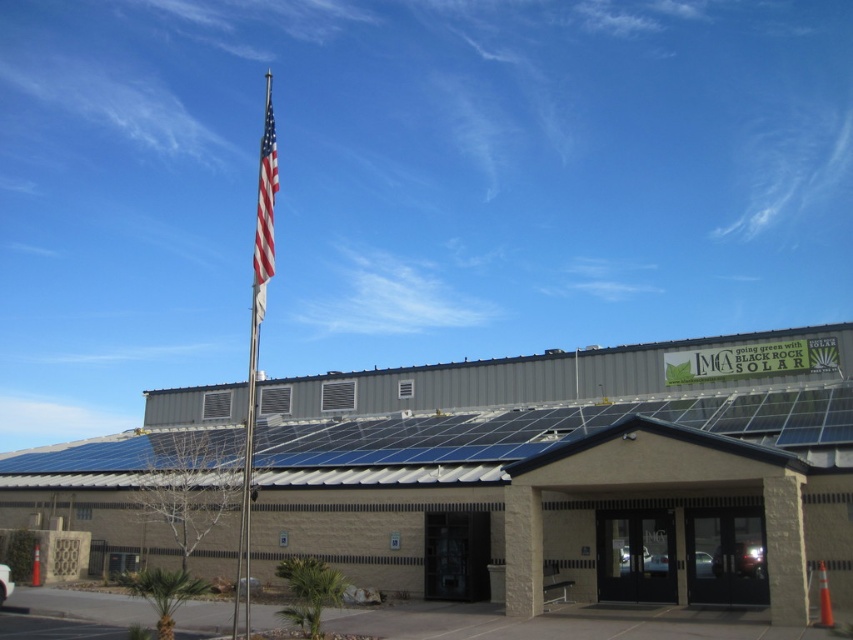
Question: Which of the following is the farthest from the observer?

Choices:
 (A) (259, 209)
 (B) (260, 241)

Answer: (A)

Question: Can you confirm if polished silver flag pole at upper center is wider than red-white-striped flag at upper center?

Choices:
 (A) no
 (B) yes

Answer: (A)

Question: Is polished silver flag pole at upper center to the right of red-white-striped flag at upper center from the viewer's perspective?

Choices:
 (A) yes
 (B) no

Answer: (B)

Question: Can you confirm if polished silver flag pole at upper center is positioned to the right of red-white-striped flag at upper center?

Choices:
 (A) no
 (B) yes

Answer: (A)

Question: Which point is farther from the camera taking this photo?

Choices:
 (A) (270, 237)
 (B) (265, 100)

Answer: (B)